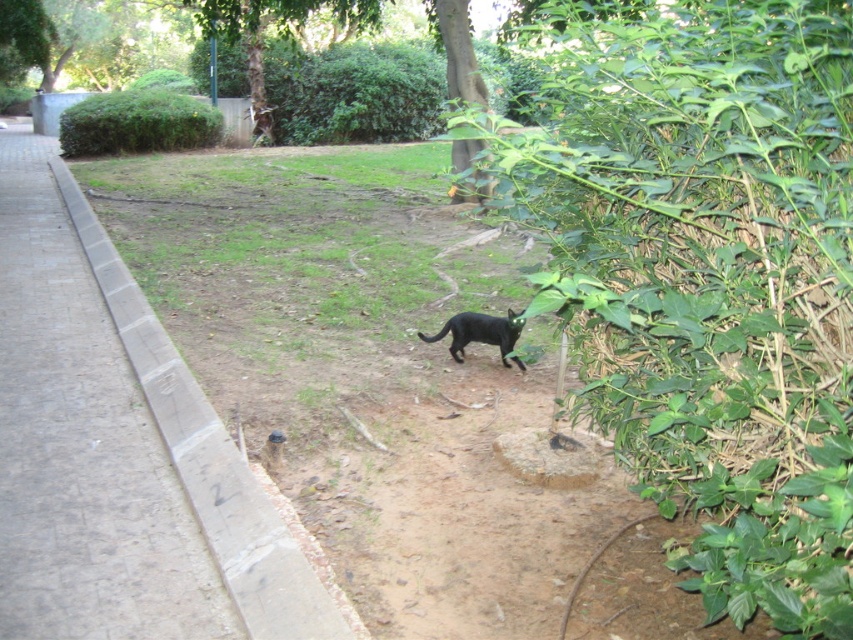
Question: Which point is farther to the camera?

Choices:
 (A) (433, 460)
 (B) (451, 356)

Answer: (B)

Question: Which of the following is the farthest from the observer?

Choices:
 (A) shiny black cat at center
 (B) black fur cat at center

Answer: (A)

Question: Which of the following is the farthest from the observer?

Choices:
 (A) black fur cat at center
 (B) shiny black cat at center
 (C) concrete pavement at left

Answer: (B)

Question: Does concrete pavement at left appear under shiny black cat at center?

Choices:
 (A) no
 (B) yes

Answer: (A)

Question: Is black fur cat at center closer to camera compared to concrete pavement at left?

Choices:
 (A) no
 (B) yes

Answer: (A)

Question: Where is black fur cat at center located in relation to shiny black cat at center in the image?

Choices:
 (A) below
 (B) above

Answer: (B)